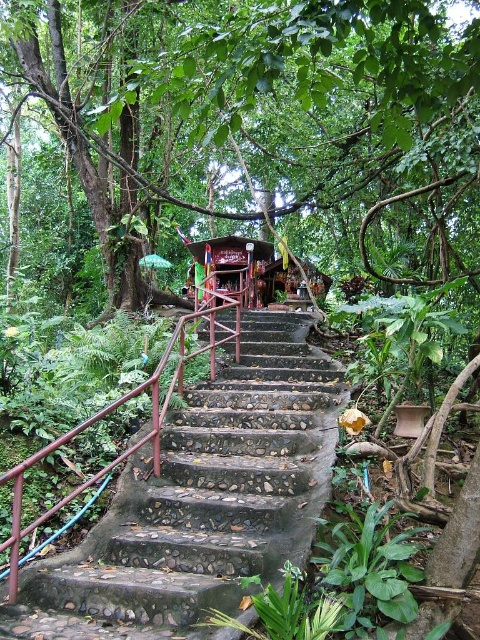
Is green leafy tree at center positioned before rustic stone stairs at center?

Yes.

Can you confirm if green leafy tree at center is positioned to the left of rustic stone stairs at center?

Yes, green leafy tree at center is to the left of rustic stone stairs at center.

Does point (387, 136) lie behind point (248, 564)?

No, it is not.

This screenshot has width=480, height=640. I want to click on green leafy tree at center, so click(x=260, y=120).